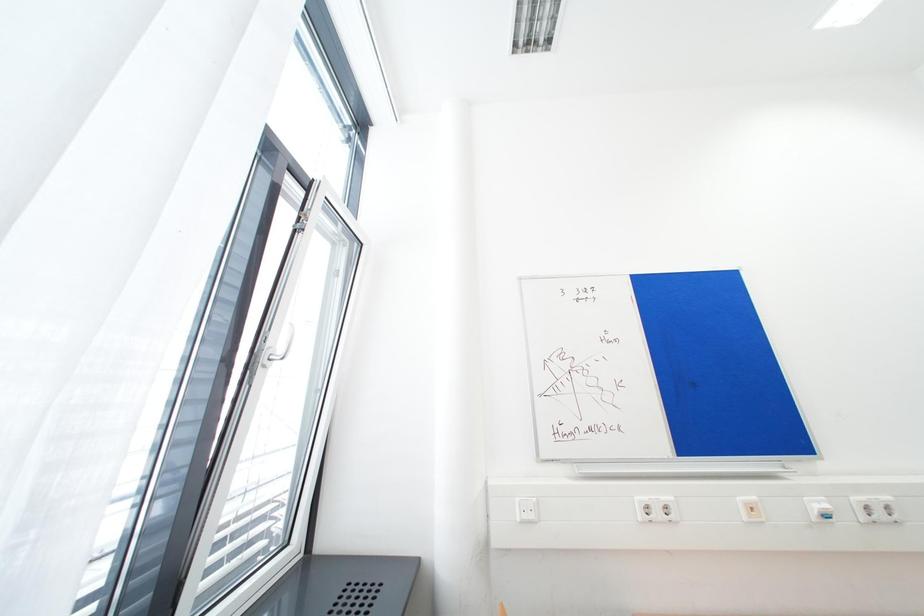
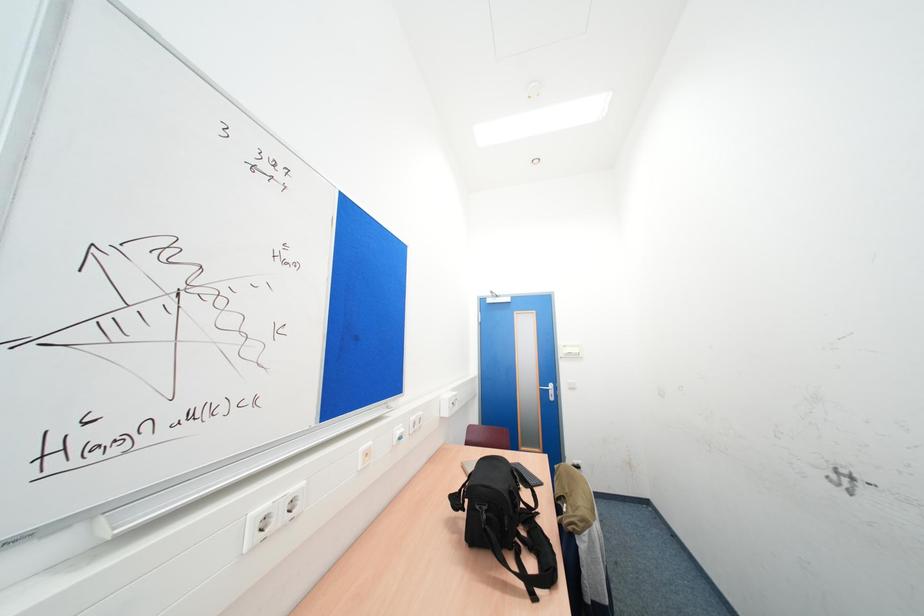
Question: The first image is from the beginning of the video and the second image is from the end. How did the camera likely rotate when shooting the video?

Choices:
 (A) Left
 (B) Right
 (C) Up
 (D) Down

Answer: (B)